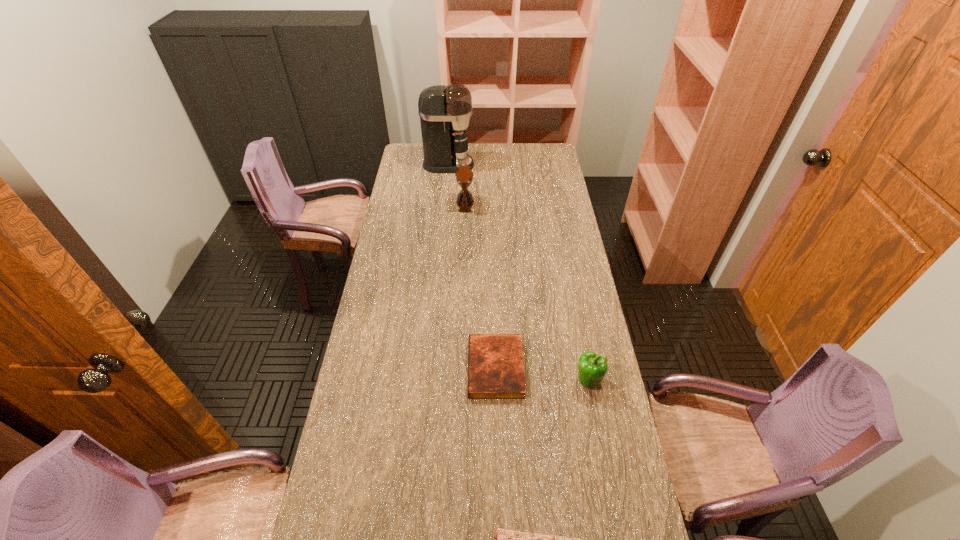
Where is `the tallest object`? the tallest object is located at coordinates (445, 111).

Locate an element on the screen. coffee maker is located at coordinates (445, 111).

I want to click on the fourth nearest object, so click(464, 176).

Find the location of a particular element. Image resolution: width=960 pixels, height=540 pixels. the rightmost object is located at coordinates (592, 367).

Image resolution: width=960 pixels, height=540 pixels. Identify the location of the fourth tallest object. (495, 361).

Where is `the taller Bible`? This screenshot has width=960, height=540. the taller Bible is located at coordinates click(495, 361).

Find the location of a particular element. The image size is (960, 540). free location located 0.170m place cup under the spout of the tallest object is located at coordinates (508, 165).

Image resolution: width=960 pixels, height=540 pixels. What are the coordinates of `vacant space located 0.340m on the front of the second farthest object` in the screenshot? It's located at (463, 266).

Find the location of a particular element. This screenshot has width=960, height=540. vacant space located 0.070m on the front of the rightmost object is located at coordinates (594, 414).

Where is `free spot located on the spine side of the taller Bible`? The height and width of the screenshot is (540, 960). free spot located on the spine side of the taller Bible is located at coordinates (399, 368).